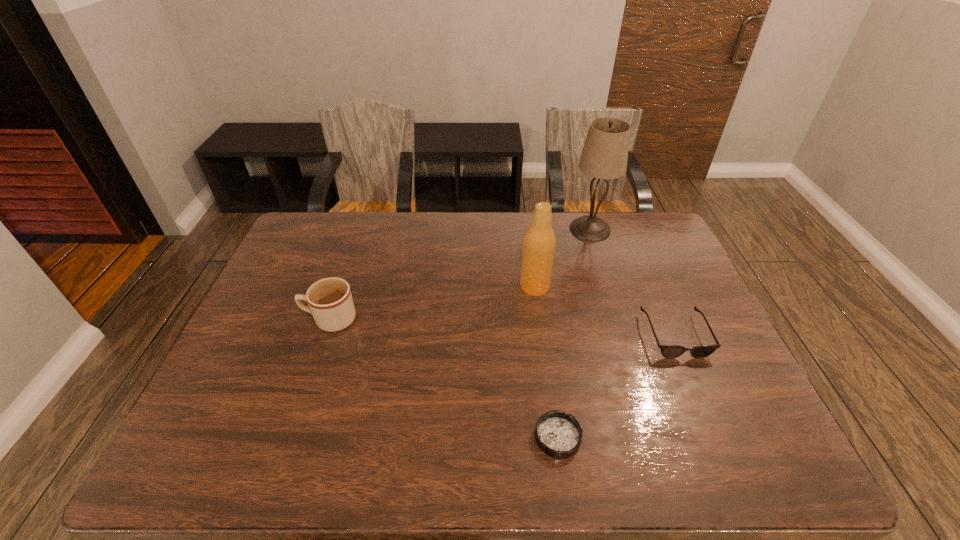
At what (x,y) coordinates should I click in order to perform the action: click on free space located 0.350m on the front of the beer bottle. Please return your answer as a coordinate pair (x, y). The width and height of the screenshot is (960, 540). Looking at the image, I should click on (550, 401).

Image resolution: width=960 pixels, height=540 pixels. I want to click on free space located 0.060m on the side of the leftmost object with the handle, so click(282, 320).

You are a GUI agent. You are given a task and a screenshot of the screen. Output one action in this format:
    pyautogui.click(x=<x>, y=<y>)
    Task: Click on the vacant space located 0.280m on the front lenses of the sunglasses
    The height and width of the screenshot is (540, 960).
    Given the screenshot: What is the action you would take?
    pyautogui.click(x=731, y=466)

The image size is (960, 540). I want to click on free space located 0.230m on the back of the shortest object, so click(x=544, y=340).

Find the location of a particular element. object that is positioned at the far edge is located at coordinates (604, 156).

Locate an element on the screen. This screenshot has height=540, width=960. object situated at the near edge is located at coordinates (559, 435).

Identify the location of object located in the left edge section of the desktop. This screenshot has height=540, width=960. (330, 302).

The width and height of the screenshot is (960, 540). Identify the location of object located in the right edge section of the desktop. (668, 351).

What are the coordinates of `free space at the far edge of the desktop` in the screenshot? It's located at (507, 220).

Where is `vacant space at the near edge`? vacant space at the near edge is located at coordinates (670, 444).